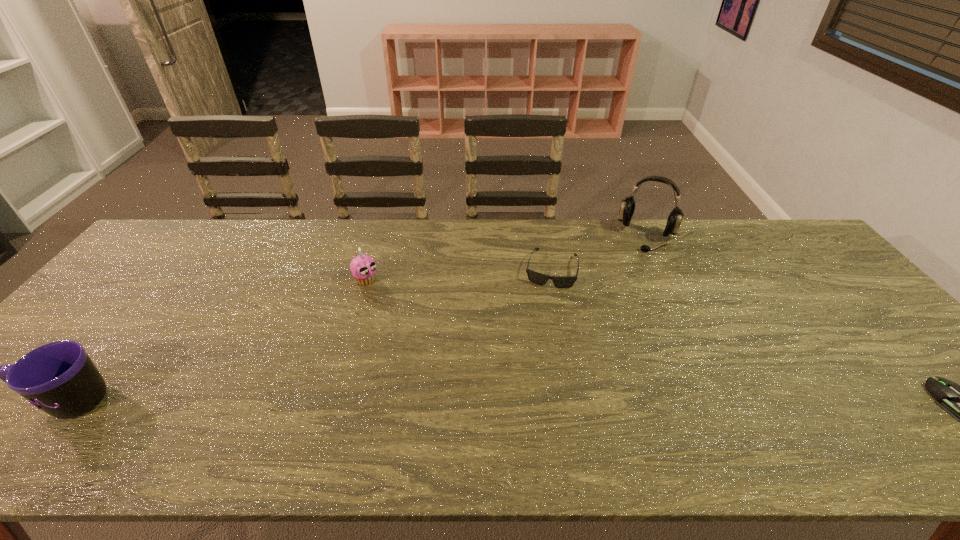
Locate an element on the screen. vacant space positioned on the face of the cupcake is located at coordinates (455, 352).

You are a GUI agent. You are given a task and a screenshot of the screen. Output one action in this format:
    pyautogui.click(x=<x>, y=<y>)
    Task: Click on the vacant region located 0.230m on the face of the cupcake
    
    Given the screenshot: What is the action you would take?
    pyautogui.click(x=424, y=327)

You are a GUI agent. You are given a task and a screenshot of the screen. Output one action in this format:
    pyautogui.click(x=<x>, y=<y>)
    Task: Click on the free spot located 0.270m with the microphone on the side of the second object from right to left
    Image resolution: width=960 pixels, height=540 pixels.
    Given the screenshot: What is the action you would take?
    pyautogui.click(x=620, y=304)

Find the location of a particular element. This screenshot has height=540, width=960. vacant space located 0.400m with the microphone on the side of the second object from right to left is located at coordinates (609, 335).

At what (x,y) coordinates should I click in order to perform the action: click on vacant space located with the microphone on the side of the second object from right to left. Please return your answer as a coordinate pair (x, y). The image size is (960, 540). Looking at the image, I should click on [633, 273].

Find the location of `sunglasses present at the far edge`. sunglasses present at the far edge is located at coordinates (538, 278).

You are a GUI agent. You are given a task and a screenshot of the screen. Output one action in this format:
    pyautogui.click(x=<x>, y=<y>)
    Task: Click on the headset situated at the far edge
    The height and width of the screenshot is (540, 960).
    Given the screenshot: What is the action you would take?
    pyautogui.click(x=627, y=208)

At what (x,y) coordinates should I click in order to perform the action: click on object at the near edge. Please return your answer as a coordinate pair (x, y). Looking at the image, I should click on (59, 378).

In order to click on object that is positioned at the left edge in this screenshot , I will do `click(59, 378)`.

This screenshot has height=540, width=960. Find the location of `object that is at the near left corner`. object that is at the near left corner is located at coordinates (59, 378).